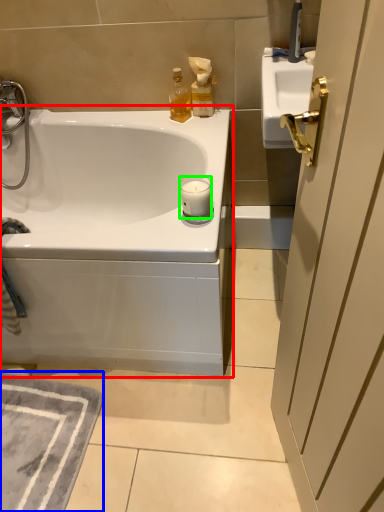
Question: Considering the real-world distances, which object is farthest from bathtub (highlighted by a red box)? bath mat (highlighted by a blue box) or candle (highlighted by a green box)?

Choices:
 (A) bath mat
 (B) candle

Answer: (B)